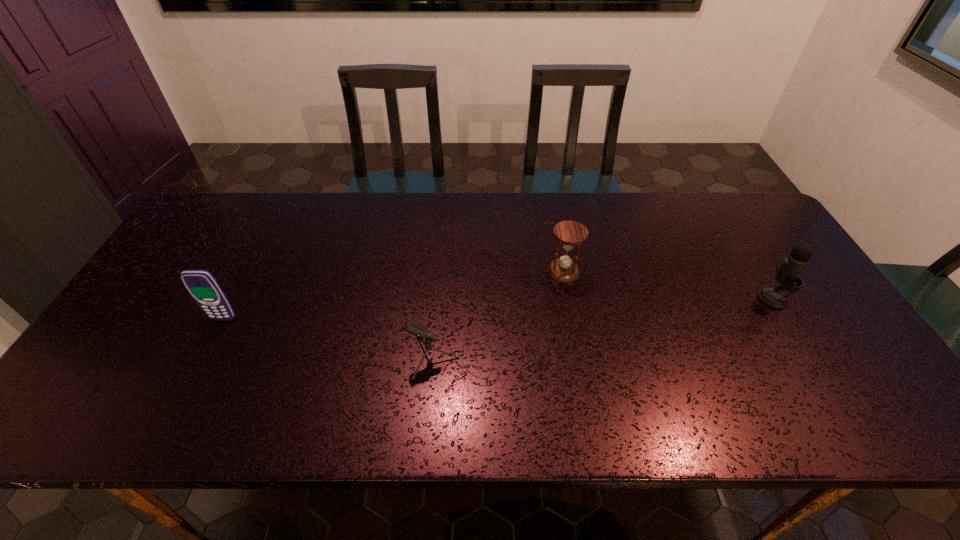
Choose which object is the nearest neighbor to the leftmost object. Please provide its 2D coordinates. Your answer should be formatted as a tuple, i.e. [(x, y)], where the tuple contains the x and y coordinates of a point satisfying the conditions above.

[(420, 331)]

Identify which object is the third nearest to the third object from left to right. Please provide its 2D coordinates. Your answer should be formatted as a tuple, i.e. [(x, y)], where the tuple contains the x and y coordinates of a point satisfying the conditions above.

[(202, 286)]